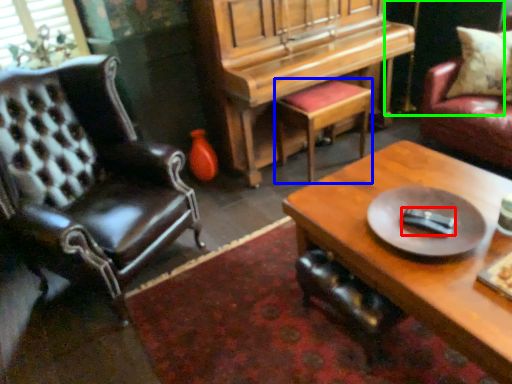
Question: Estimate the real-world distances between objects in this image. Which object is closer to remote control (highlighted by a red box), stool (highlighted by a blue box) or dark (highlighted by a green box)?

Choices:
 (A) stool
 (B) dark

Answer: (A)